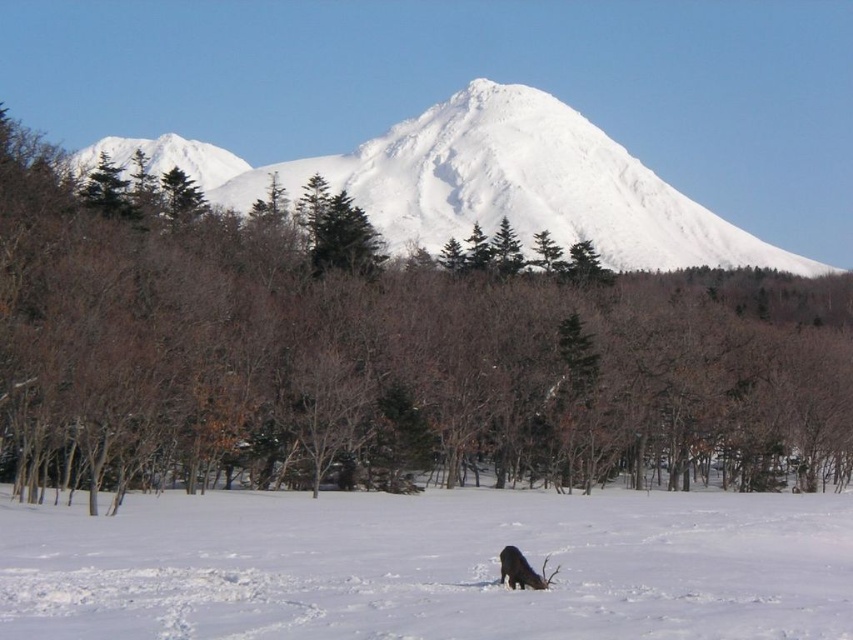
You are an observer standing in the winter landscape. You notice a green leafy tree at center and white fluffy snow at center. Which object is closer to you?

The green leafy tree at center is closer to you because the white fluffy snow at center is behind it.